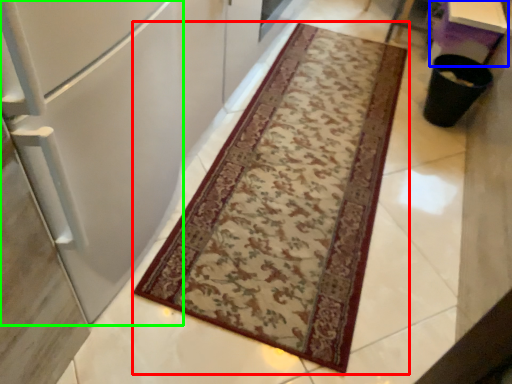
Question: Considering the real-world distances, which object is farthest from mat (highlighted by a red box)? table (highlighted by a blue box) or fridge (highlighted by a green box)?

Choices:
 (A) table
 (B) fridge

Answer: (A)